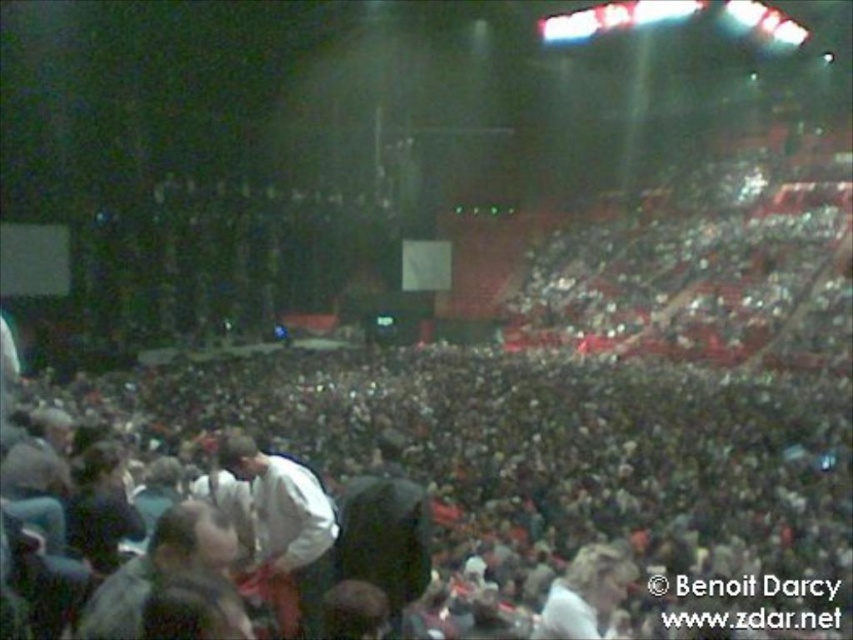
At what (x,y) coordinates should I click in order to perform the action: click on white matte shirt at lower left. Please return your answer as a coordinate pair (x, y). This screenshot has width=853, height=640. Looking at the image, I should click on (283, 532).

Which is more to the left, white matte shirt at lower left or dark gray fabric jacket at center?

white matte shirt at lower left

Which is in front, point (281, 556) or point (397, 518)?

Point (281, 556)

You are a GUI agent. You are given a task and a screenshot of the screen. Output one action in this format:
    pyautogui.click(x=<x>, y=<y>)
    Task: Click on the white matte shirt at lower left
    
    Given the screenshot: What is the action you would take?
    pyautogui.click(x=283, y=532)

Is point (379, 476) closer to viewer compared to point (555, 595)?

No, (379, 476) is behind (555, 595).

Where is `dark gray fabric jacket at center`? dark gray fabric jacket at center is located at coordinates (384, 529).

Is point (384, 458) less distant than point (567, 584)?

No.

Identify the location of dark gray fabric jacket at center. (384, 529).

Who is shorter, white matte shirt at lower left or white cotton shirt at center?

With less height is white cotton shirt at center.

Is white matte shirt at lower left shorter than white cotton shirt at center?

Incorrect, white matte shirt at lower left's height does not fall short of white cotton shirt at center's.

Between point (260, 531) and point (579, 577), which one is positioned behind?

The point (260, 531) is more distant.

Where is `white matte shirt at lower left`? This screenshot has width=853, height=640. white matte shirt at lower left is located at coordinates (283, 532).